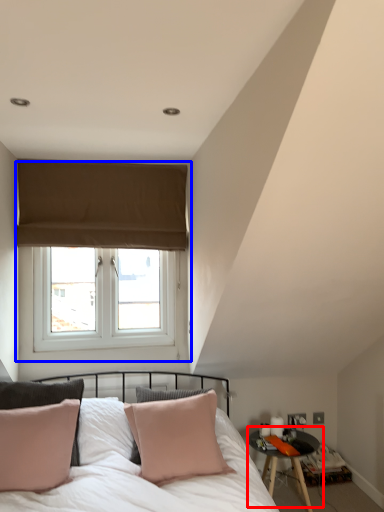
Question: Which point is closer to the camera, table (highlighted by a red box) or window (highlighted by a blue box)?

Choices:
 (A) table
 (B) window

Answer: (A)